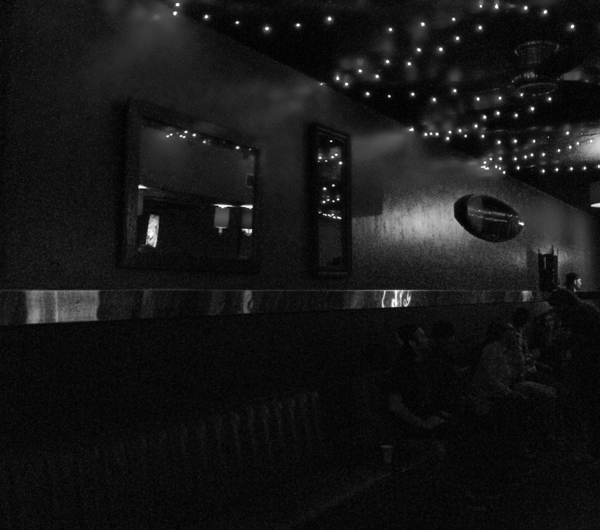
This screenshot has height=530, width=600. I want to click on this person looks like he is sitting higher like on a bar stool, so click(576, 282).